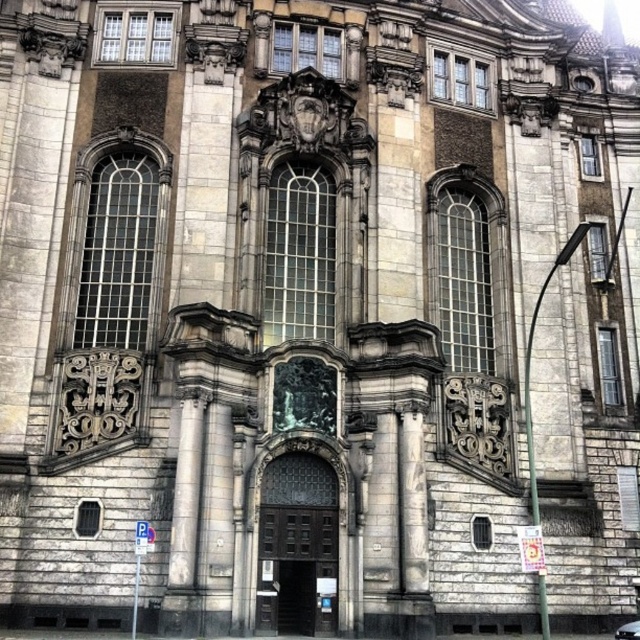
You are standing in front of the historic building and want to take a photo of both the white marble column at center and the metallic silver car at center. Which object should you focus on first to ensure both are in the frame?

You should focus on the white marble column at center first since it is closer to you than the metallic silver car at center, ensuring both are in the frame by adjusting the camera angle accordingly.

You are standing in front of the grand historic building. There is a point marked at coordinates (412, 504). What object is located at that point?

The point at coordinates (412, 504) marks the location of the white marble column at center.

You are an architect examining the building facade. You notice the white marble column at center and the metallic silver car at center. Which object is narrower?

The white marble column at center is narrower than the metallic silver car at center.